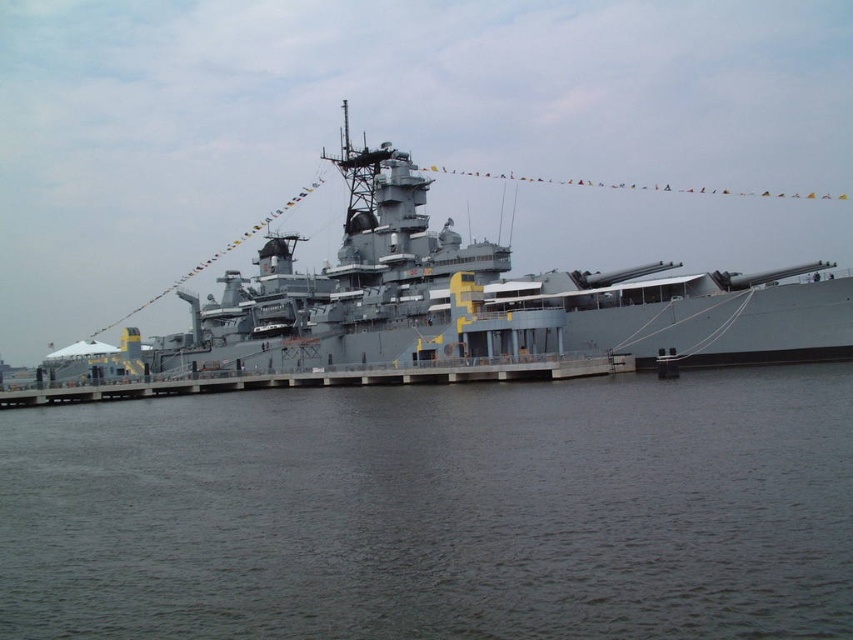
Looking at this image, you are a maintenance worker on the gray concrete dock at center and need to reach the dark gray water at lower center to inspect a floating sensor. The safety protocol states that you must stay within 20 meters of the dock at all times. Can you safely reach the water without violating the protocol?

The dark gray water at lower center is 24.19 meters away from the gray concrete dock at center. Since the safety protocol requires staying within 20 meters, you cannot safely reach the water without violating the protocol.

You are a dock worker who needs to secure the gray metallic battleship at center to the gray concrete dock at center. Given that the battleship is larger, which object requires more securing points to handle its size?

The gray metallic battleship at center requires more securing points because it is larger in size than the gray concrete dock at center.